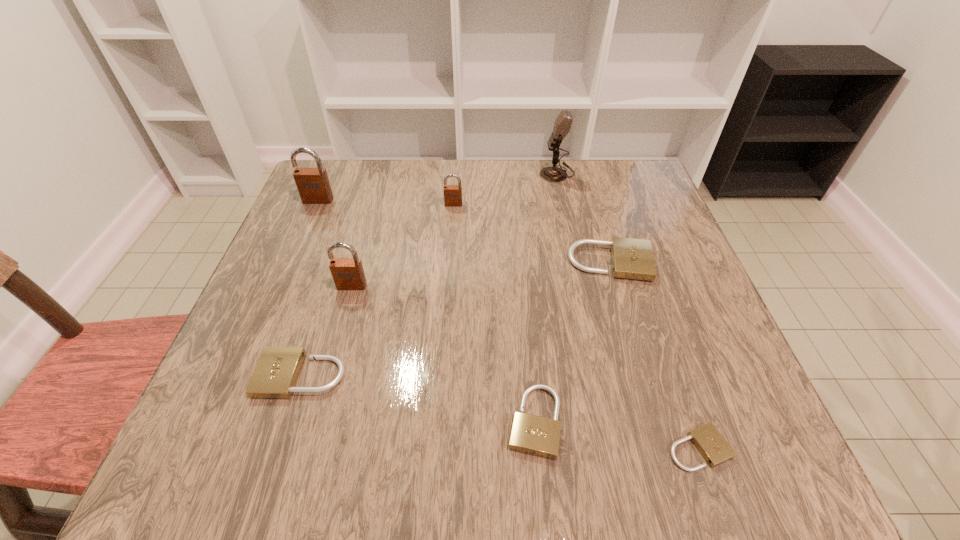
Find the location of a particular element. The image size is (960, 540). beige padlock that can be found as the third closest to the shortest padlock is located at coordinates coord(275,375).

I want to click on beige padlock that stands as the third closest to the shortest object, so click(x=275, y=375).

You are a GUI agent. You are given a task and a screenshot of the screen. Output one action in this format:
    pyautogui.click(x=<x>, y=<y>)
    Task: Click on the free space that satisfies the following two spatial constraints: 1. on the front-facing side of the farthest object; 2. on the front-facing side of the tallest padlock
    The width and height of the screenshot is (960, 540).
    Given the screenshot: What is the action you would take?
    pyautogui.click(x=564, y=200)

Locate an element on the screen. The height and width of the screenshot is (540, 960). free point that satisfies the following two spatial constraints: 1. on the front-facing side of the microphone; 2. on the front-facing side of the biggest brown padlock is located at coordinates (564, 200).

In order to click on free space that satisfies the following two spatial constraints: 1. on the front-facing side of the second biggest beige padlock; 2. on the right side of the leftmost brown padlock in this screenshot , I will do `click(244, 375)`.

Where is `vacant space that satisfies the following two spatial constraints: 1. on the front-facing side of the farthest beige padlock; 2. on the left side of the smallest brown padlock`? The image size is (960, 540). vacant space that satisfies the following two spatial constraints: 1. on the front-facing side of the farthest beige padlock; 2. on the left side of the smallest brown padlock is located at coordinates (449, 263).

Find the location of `free space that satisfies the following two spatial constraints: 1. on the front-facing side of the microphone; 2. on the front-facing side of the tallest padlock`. free space that satisfies the following two spatial constraints: 1. on the front-facing side of the microphone; 2. on the front-facing side of the tallest padlock is located at coordinates (564, 200).

Image resolution: width=960 pixels, height=540 pixels. In order to click on free region that satisfies the following two spatial constraints: 1. on the front-facing side of the third tallest padlock; 2. on the right side of the second beige padlock from left to right in this screenshot , I will do `click(439, 421)`.

Identify the location of free spot that satisfies the following two spatial constraints: 1. on the front-facing side of the rightmost brown padlock; 2. on the left side of the fourth shortest object. (449, 263).